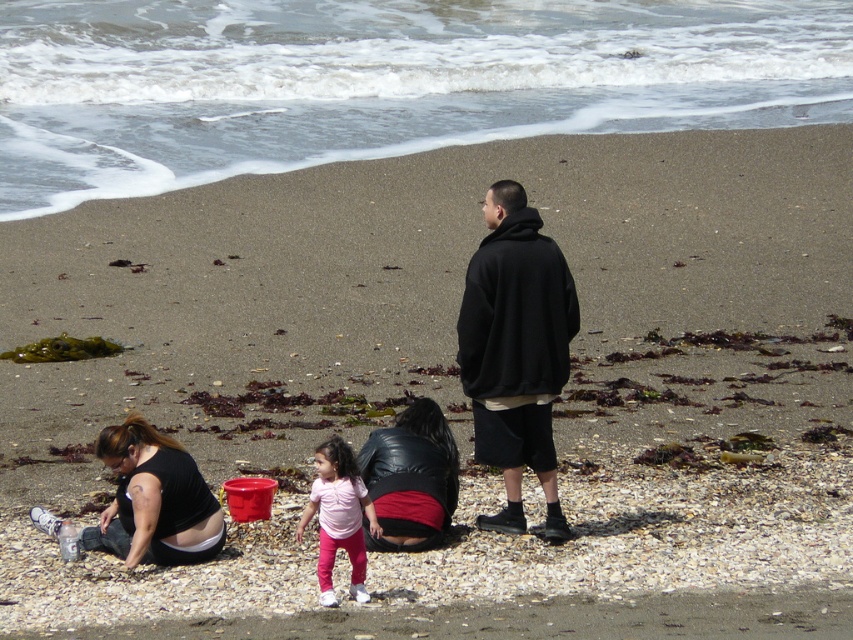
Does black matte hoodie at center come behind matte black shirt at lower left?

No, it is not.

Is black matte hoodie at center thinner than matte black shirt at lower left?

Correct, black matte hoodie at center's width is less than matte black shirt at lower left's.

What do you see at coordinates (515, 349) in the screenshot? I see `black matte hoodie at center` at bounding box center [515, 349].

The height and width of the screenshot is (640, 853). Identify the location of black matte hoodie at center. (515, 349).

Is black matte hoodie at center closer to camera compared to pink matte pants at center?

No, black matte hoodie at center is further to the viewer.

In the scene shown: Who is taller, black matte hoodie at center or pink matte pants at center?

Standing taller between the two is black matte hoodie at center.

Which is in front, point (480, 365) or point (328, 477)?

Point (328, 477) is more forward.

You are a GUI agent. You are given a task and a screenshot of the screen. Output one action in this format:
    pyautogui.click(x=<x>, y=<y>)
    Task: Click on the black matte hoodie at center
    The height and width of the screenshot is (640, 853).
    Given the screenshot: What is the action you would take?
    pyautogui.click(x=515, y=349)

Is point (136, 556) less distant than point (321, 499)?

That is False.

Is point (173, 516) farther from camera compared to point (344, 452)?

That is True.

Image resolution: width=853 pixels, height=640 pixels. What are the coordinates of `matte black shirt at lower left` in the screenshot? It's located at (154, 500).